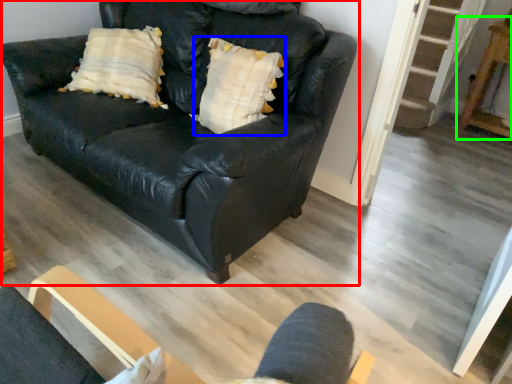
Question: Which object is positioned farthest from studio couch (highlighted by a red box)? Select from pillow (highlighted by a blue box) and table (highlighted by a green box).

Choices:
 (A) pillow
 (B) table

Answer: (B)